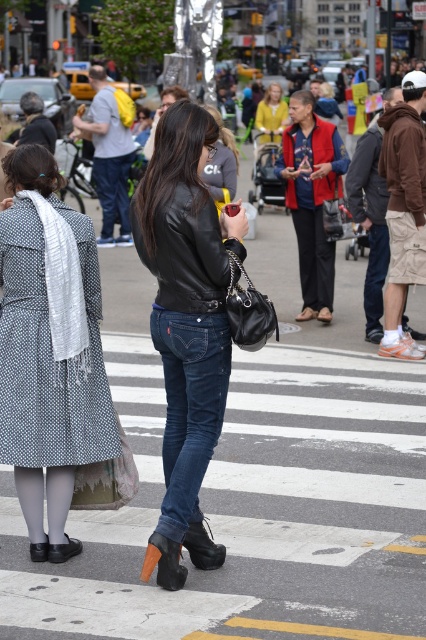
Question: Which is farther from the dark blue denim jeans at center?

Choices:
 (A) polka dot dress at center
 (B) leather jacket at center

Answer: (A)

Question: Which of the following is the farthest from the observer?

Choices:
 (A) click(x=215, y=336)
 (B) click(x=89, y=340)
 (C) click(x=207, y=342)

Answer: (B)

Question: Based on their relative distances, which object is farther from the dark blue denim jeans at center?

Choices:
 (A) polka dot dress at center
 (B) leather jacket at center

Answer: (A)

Question: Is polka dot dress at center below dark blue denim jeans at center?

Choices:
 (A) no
 (B) yes

Answer: (A)

Question: Does leather jacket at center have a smaller size compared to dark blue denim jeans at center?

Choices:
 (A) yes
 (B) no

Answer: (B)

Question: Where is leather jacket at center located in relation to dark blue denim jeans at center in the image?

Choices:
 (A) right
 (B) left

Answer: (A)